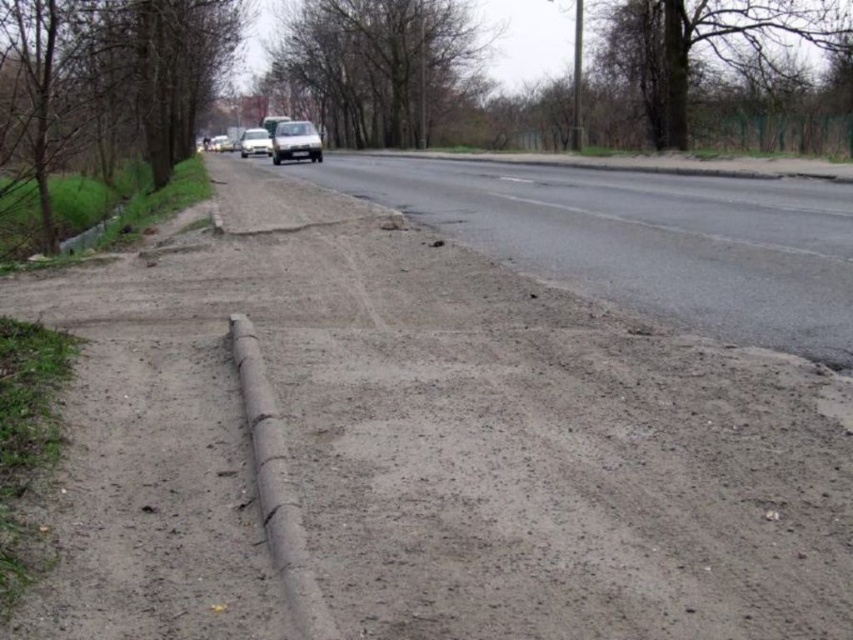
Does satin silver sedan at center have a smaller size compared to white matte car at center?

Incorrect, satin silver sedan at center is not smaller in size than white matte car at center.

Is point (308, 145) farther from viewer compared to point (242, 140)?

No, it is not.

Image resolution: width=853 pixels, height=640 pixels. I want to click on satin silver sedan at center, so tap(294, 141).

Can you confirm if satin silver sedan at center is thinner than matte black car at center?

No.

Who is more forward, (297, 147) or (223, 144)?

Point (297, 147)

This screenshot has width=853, height=640. Find the location of `satin silver sedan at center`. satin silver sedan at center is located at coordinates (294, 141).

Who is positioned more to the right, white matte car at center or matte black car at center?

From the viewer's perspective, white matte car at center appears more on the right side.

Describe the element at coordinates (254, 141) in the screenshot. I see `white matte car at center` at that location.

What are the coordinates of `white matte car at center` in the screenshot? It's located at (254, 141).